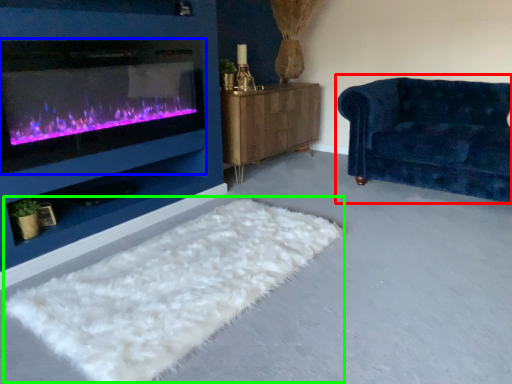
Question: Which object is positioned farthest from studio couch (highlighted by a red box)? Select from wood burning stove (highlighted by a blue box) and mat (highlighted by a green box).

Choices:
 (A) wood burning stove
 (B) mat

Answer: (A)